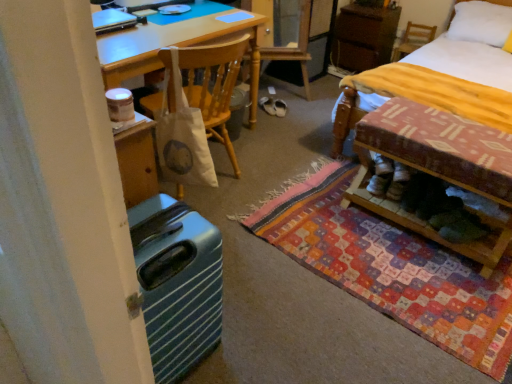
Identify the location of space that is in front of wooden bed frame at lower right. (437, 289).